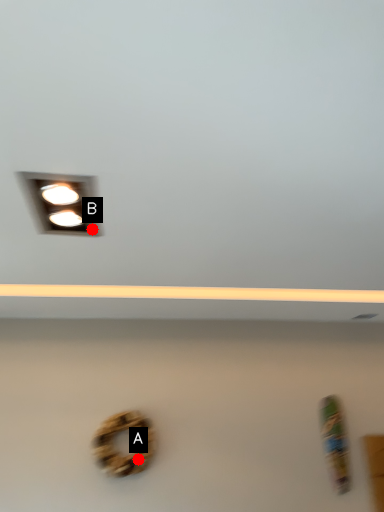
Question: Two points are circled on the image, labeled by A and B beside each circle. Which of the following is the farthest from the observer?

Choices:
 (A) A is further
 (B) B is further

Answer: (A)